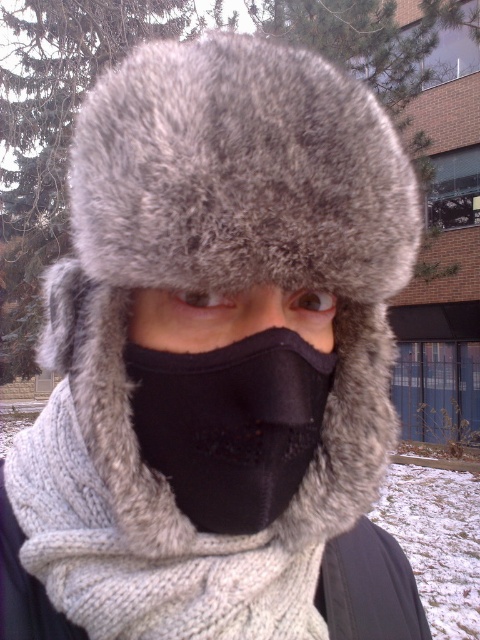
You are standing in front of the building with the brick facade and large windows. There are two points marked on the windows. One is at point [300,312] and the other at point [147,305]. Which point is closer to you?

Point [300,312] is further to the viewer than point [147,305], so the point closer to you is point [147,305].

You are a fashion designer analyzing the facial coverings in the image. The black fleece mask at center and the black matte nose at center are both part of the person wearing them. Can you determine which one is wider?

The black fleece mask at center is wider than the black matte nose at center according to the description.

You are a photographer standing at the camera position. You want to take a photo of the person wearing a thick, grayish brown fur trimmed hat and a black face covering with a light gray knitted scarf. The photo requires the subject to be exactly 18 inches away from the camera. Is the point at coordinates point [144,326] positioned correctly to achieve this requirement?

The distance between point [144,326] and the camera is 18.21 inches, which is slightly more than the required 18 inches. Therefore, the point at coordinates point [144,326] is positioned slightly farther away than the required distance.